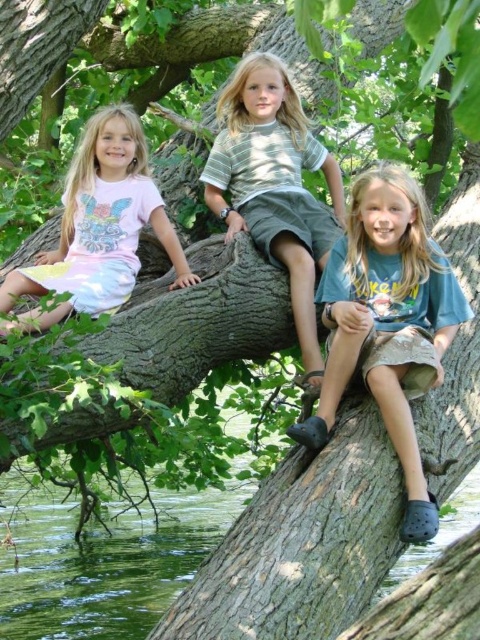
Question: Among these objects, which one is nearest to the camera?

Choices:
 (A) striped cotton shirt at center
 (B) pink fabric dress at left
 (C) blue cotton shirt at center

Answer: (C)

Question: Where is striped cotton shirt at center located in relation to pink fabric dress at left in the image?

Choices:
 (A) right
 (B) left

Answer: (A)

Question: Observing the image, what is the correct spatial positioning of blue cotton shirt at center in reference to striped cotton shirt at center?

Choices:
 (A) below
 (B) above

Answer: (A)

Question: Which object appears farthest from the camera in this image?

Choices:
 (A) pink fabric dress at left
 (B) blue cotton shirt at center
 (C) striped cotton shirt at center

Answer: (C)

Question: Does blue cotton shirt at center have a larger size compared to striped cotton shirt at center?

Choices:
 (A) yes
 (B) no

Answer: (A)

Question: Estimate the real-world distances between objects in this image. Which object is closer to the striped cotton shirt at center?

Choices:
 (A) pink fabric dress at left
 (B) blue cotton shirt at center

Answer: (B)